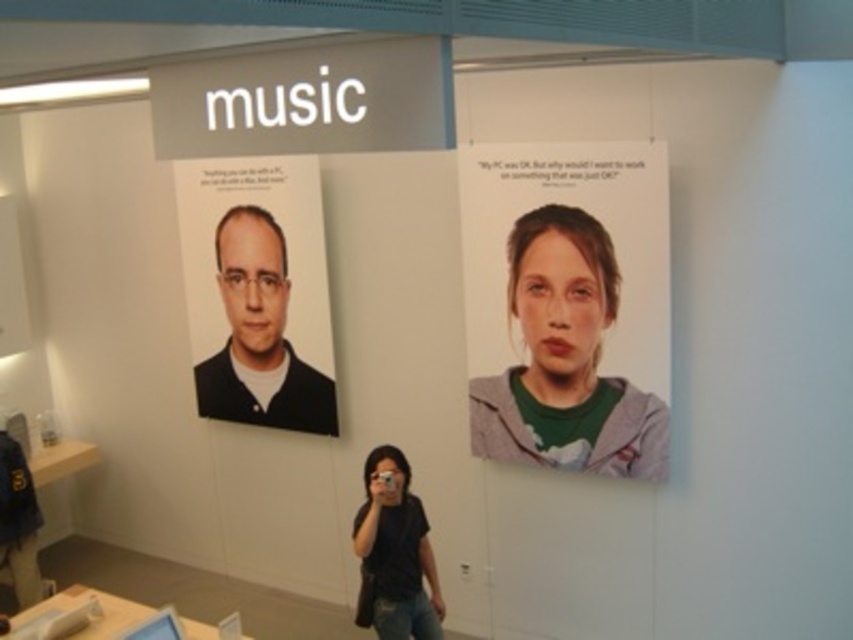
You are a customer in a store and you want to take a closer look at the matte black portrait at left and the black matte shirt at lower center. Which object is placed higher on the wall?

The matte black portrait at left is positioned over the black matte shirt at lower center, so it is placed higher on the wall.

You are a customer standing in front of the posters. Which poster can you see more clearly, the green fabric face at upper right or the matte black portrait at left?

The green fabric face at upper right is in front of the matte black portrait at left, so the green fabric face at upper right is more clearly visible.